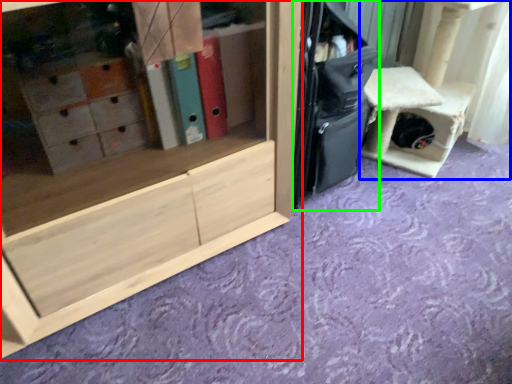
Question: Which is farther away from cabinetry (highlighted by a red box)? furniture (highlighted by a blue box) or luggage (highlighted by a green box)?

Choices:
 (A) furniture
 (B) luggage

Answer: (A)